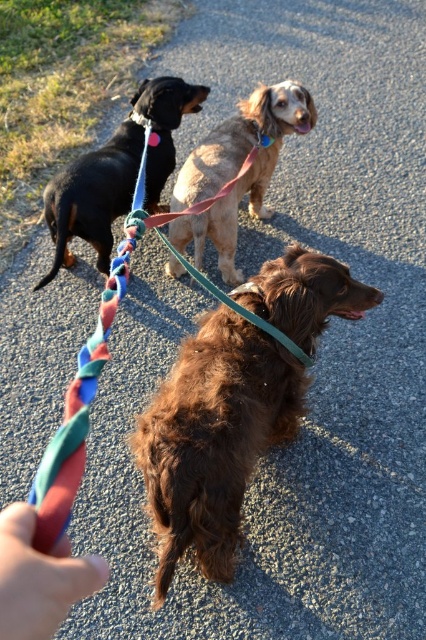
Question: Which point is farther from the camera taking this photo?

Choices:
 (A) (16, 609)
 (B) (181, 429)
 (C) (238, 289)
 (D) (123, 275)

Answer: (C)

Question: Which point is closer to the camera?

Choices:
 (A) green fabric leash at center
 (B) black glossy dog at left

Answer: (A)

Question: Which point is closer to the camera taking this photo?

Choices:
 (A) (135, 108)
 (B) (66, 566)

Answer: (B)

Question: Does golden fur dog at center appear on the left side of black glossy dog at left?

Choices:
 (A) yes
 (B) no

Answer: (B)

Question: Does multicolored braided leash at center appear under blue fabric neckband at upper center?

Choices:
 (A) no
 (B) yes

Answer: (B)

Question: Observing the image, what is the correct spatial positioning of smooth skin hand at lower left in reference to blue fabric neckband at upper center?

Choices:
 (A) below
 (B) above

Answer: (A)